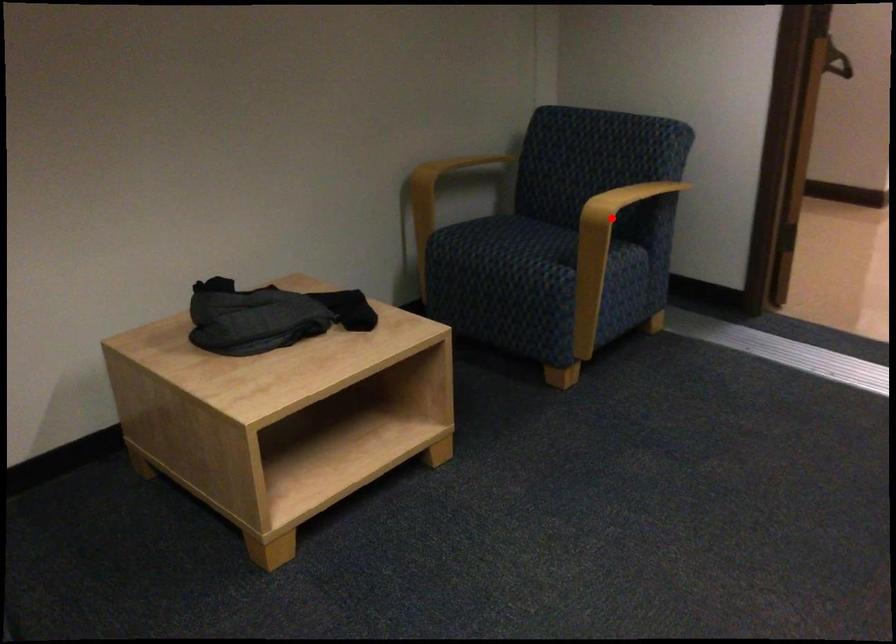
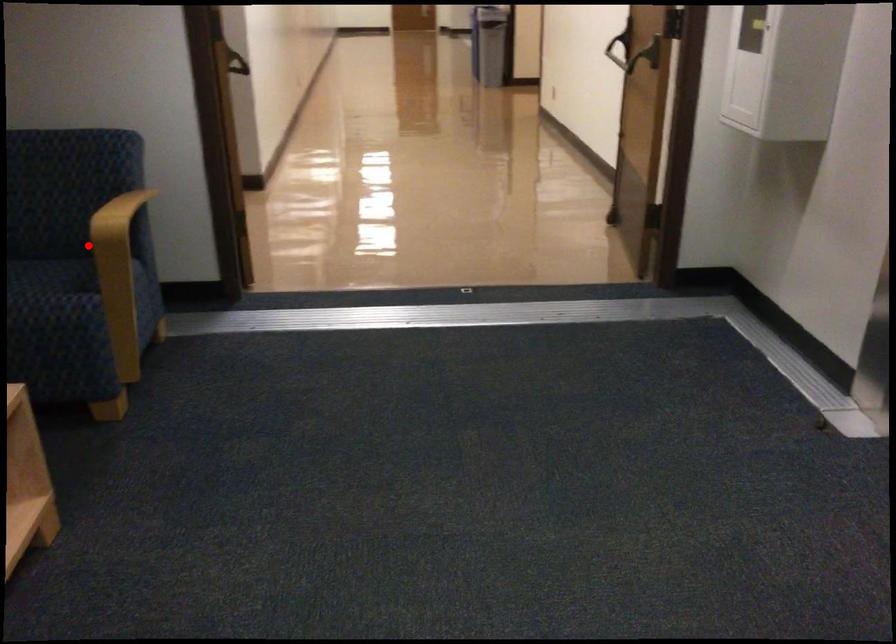
I am providing you with two images of the same scene from different viewpoints. A red point is marked on the first image and another point is marked on the second image. Do the highlighted points in image1 and image2 indicate the same real-world spot?

Yes